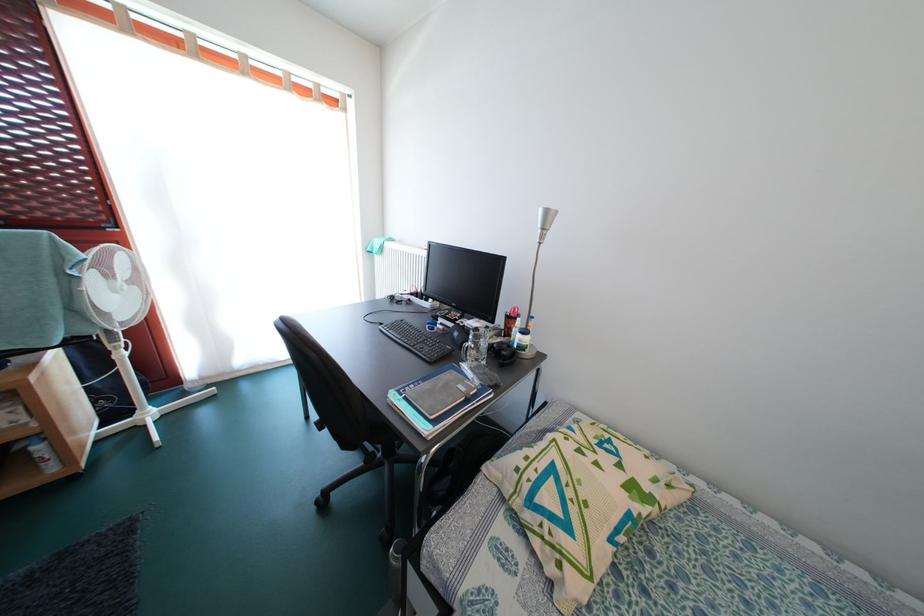
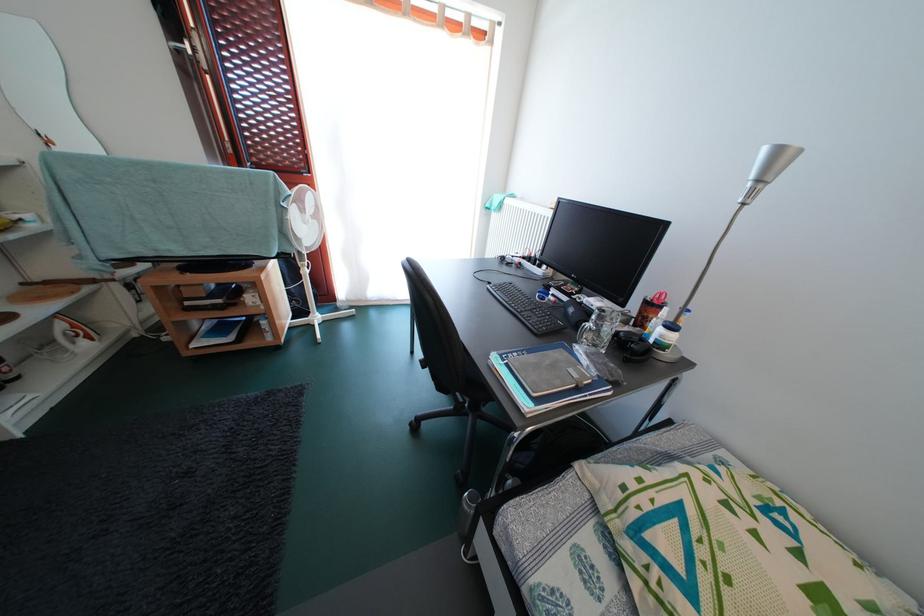
Question: I am providing you with two images of the same scene from different viewpoints. After the viewpoint changes to image2, which objects are now occluded?

Choices:
 (A) silver lamp head
 (B) black remote control
 (C) metal water bottle
 (D) none of these

Answer: (D)